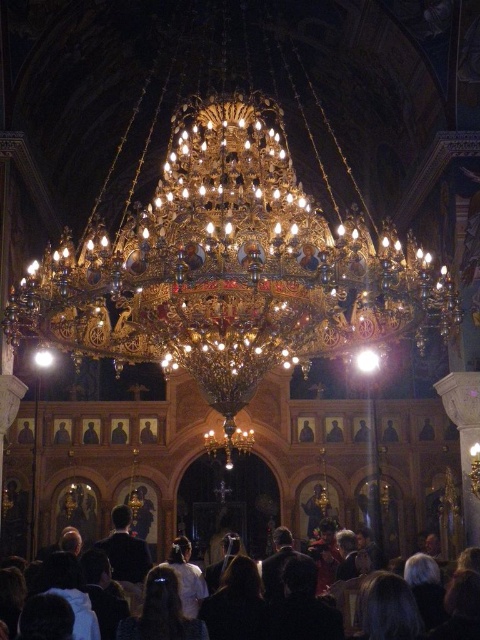
Who is positioned more to the right, dark brown wooden figure at center or smooth black portrait at center?

smooth black portrait at center

Is point (23, 428) positioned after point (299, 428)?

That is False.

Who is more distant from viewer, (28, 420) or (302, 422)?

The point (302, 422) is more distant.

Where is `dark brown wooden figure at center`? The height and width of the screenshot is (640, 480). dark brown wooden figure at center is located at coordinates (24, 432).

Does black fabric crowd at lower center have a lesser width compared to wooden framed portrait at center?

No.

Does black fabric crowd at lower center have a larger size compared to wooden framed portrait at center?

Yes, black fabric crowd at lower center is bigger than wooden framed portrait at center.

Find the location of a particular element. This screenshot has height=640, width=480. black fabric crowd at lower center is located at coordinates (443, 602).

Image resolution: width=480 pixels, height=640 pixels. What are the coordinates of `black fabric crowd at lower center` in the screenshot? It's located at (443, 602).

Does dark brown wood portrait at center have a lesser height compared to wooden portrait at center?

No, dark brown wood portrait at center is not shorter than wooden portrait at center.

Based on the photo, can you confirm if dark brown wood portrait at center is bigger than wooden portrait at center?

No, dark brown wood portrait at center is not bigger than wooden portrait at center.

Is point (95, 422) farther from viewer compared to point (63, 420)?

No, (95, 422) is closer to viewer.

Find the location of a particular element. The image size is (480, 640). dark brown wood portrait at center is located at coordinates (91, 432).